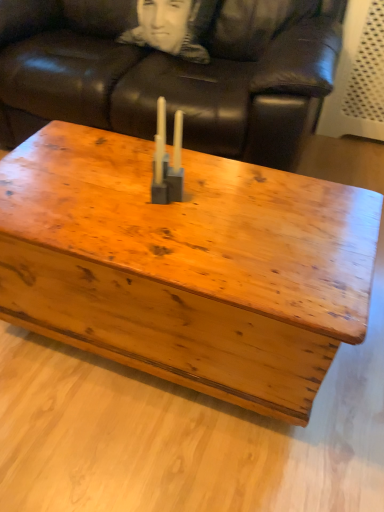
Question: Relative to brown leather couch at upper center, is black fabric pillow at upper center in front or behind?

Choices:
 (A) behind
 (B) front

Answer: (A)

Question: Considering the positions of black fabric pillow at upper center and brown leather couch at upper center in the image, is black fabric pillow at upper center taller or shorter than brown leather couch at upper center?

Choices:
 (A) tall
 (B) short

Answer: (B)

Question: Estimate the real-world distances between objects in this image. Which object is closer to the black fabric pillow at upper center?

Choices:
 (A) wooden coffee table at center
 (B) matte gray plastic candle holder at center
 (C) brown leather couch at upper center

Answer: (C)

Question: Considering the real-world distances, which object is farthest from the black fabric pillow at upper center?

Choices:
 (A) wooden coffee table at center
 (B) brown leather couch at upper center
 (C) matte gray plastic candle holder at center

Answer: (A)